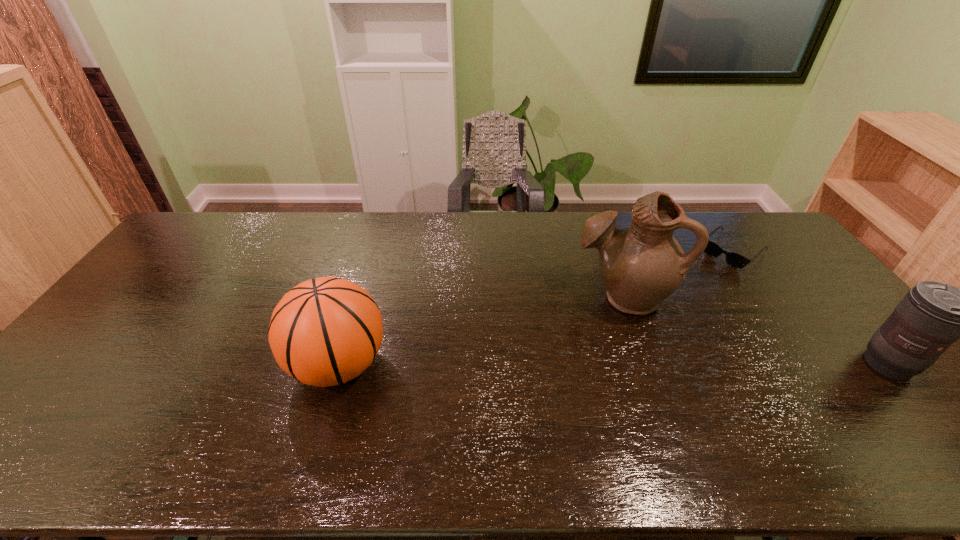
In the image, there is a desktop. Where is `vacant space at the left edge`? The image size is (960, 540). vacant space at the left edge is located at coordinates (193, 268).

In the image, there is a desktop. At what (x,y) coordinates should I click in order to perform the action: click on free space at the right edge. Please return your answer as a coordinate pair (x, y). Looking at the image, I should click on (800, 285).

The width and height of the screenshot is (960, 540). In the image, there is a desktop. In order to click on vacant area at the far left corner in this screenshot , I will do `click(228, 233)`.

The height and width of the screenshot is (540, 960). In the image, there is a desktop. What are the coordinates of `free region at the far right corner` in the screenshot? It's located at coord(785,249).

Find the location of a particular element. The image size is (960, 540). free space between the basketball and the pitcher is located at coordinates (481, 331).

Find the location of a particular element. This screenshot has width=960, height=540. vacant space that's between the rightmost object and the tallest object is located at coordinates (756, 330).

Locate an element on the screen. The width and height of the screenshot is (960, 540). free spot between the tallest object and the leftmost object is located at coordinates (481, 331).

Identify the location of empty space that is in between the rightmost object and the leftmost object. Image resolution: width=960 pixels, height=540 pixels. (613, 364).

Find the location of `blank region between the basketball and the third object from left to right`. blank region between the basketball and the third object from left to right is located at coordinates (536, 308).

Image resolution: width=960 pixels, height=540 pixels. Identify the location of empty space that is in between the basketball and the pitcher. (481, 331).